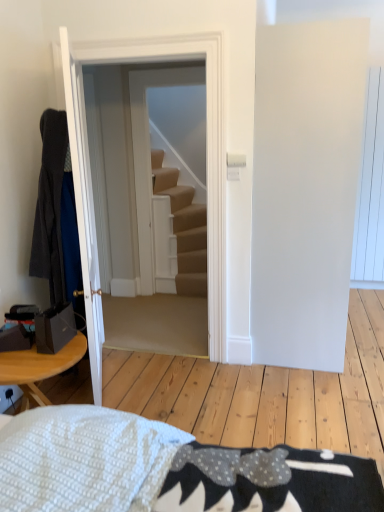
Question: Would you say carpeted stairs at center is inside or outside dark gray fabric robe at left?

Choices:
 (A) inside
 (B) outside

Answer: (B)

Question: From a real-world perspective, is carpeted stairs at center positioned above or below dark gray fabric robe at left?

Choices:
 (A) below
 (B) above

Answer: (A)

Question: Which object is the farthest from the white wooden door at center, the first door viewed from the right?

Choices:
 (A) white glossy door at left, the 2th door when ordered from right to left
 (B) dark gray fabric robe at left
 (C) carpeted stairs at center

Answer: (C)

Question: Which object is positioned farthest from the dark gray fabric robe at left?

Choices:
 (A) white wooden door at center, which appears as the 2th door when viewed from the left
 (B) carpeted stairs at center
 (C) white glossy door at left, the 2th door when ordered from right to left

Answer: (B)